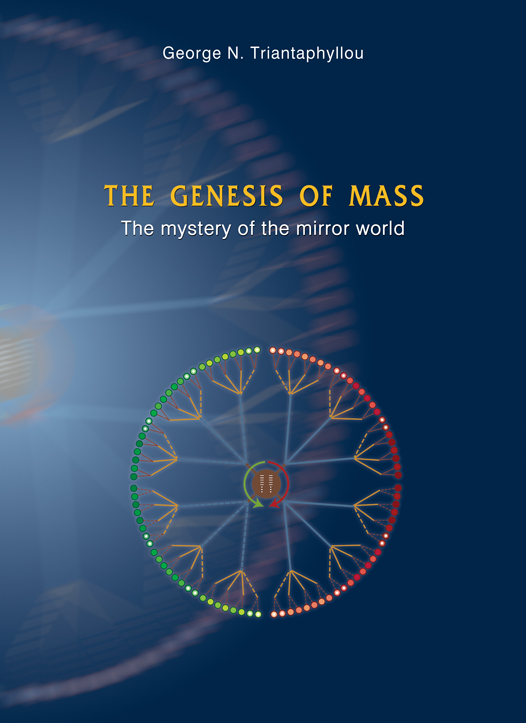
Locate an element on the screen. The width and height of the screenshot is (526, 723). light is located at coordinates (101, 304).